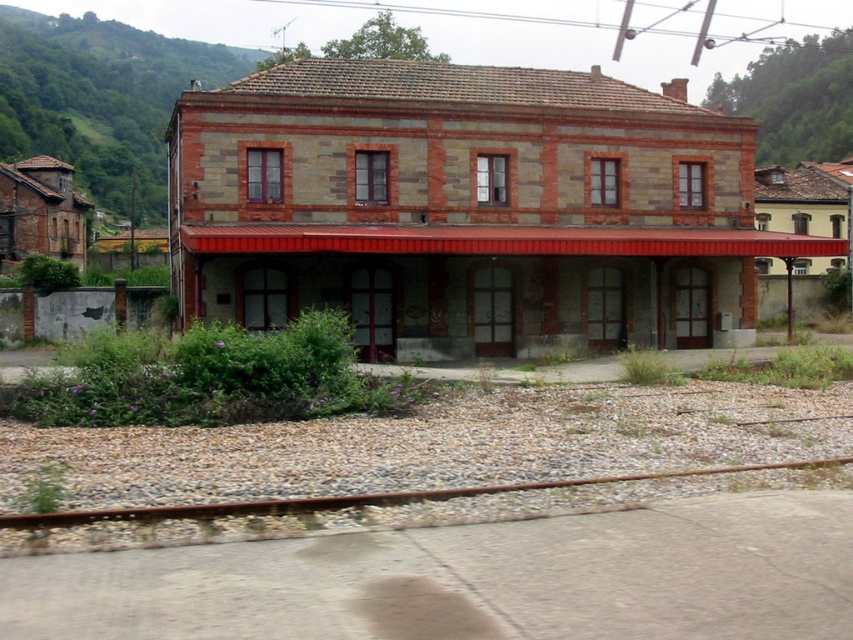
You are standing at the base of the two story building with a red tiled roof and brick facade. You want to walk to the point marked at coordinate (726, 292). How far will you have to walk in meters?

The point at coordinate (726, 292) is 32.87 meters away from you, so you will have to walk 32.87 meters.

You are standing at the point marked by point (x=467, y=209) in the image. Which direction should you walk to reach the brick railway station at center?

The point (x=467, y=209) is already at the brick railway station at center, so you are already there.